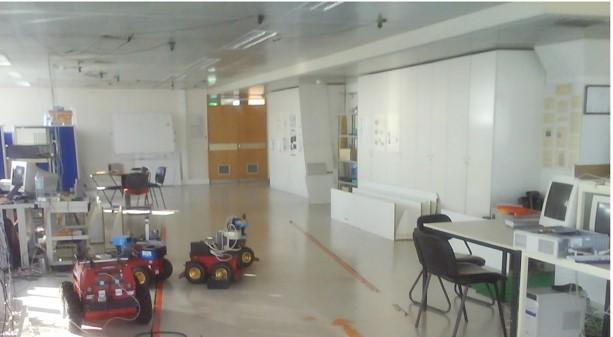
You are a GUI agent. You are given a task and a screenshot of the screen. Output one action in this format:
    pyautogui.click(x=<x>, y=<y>)
    Task: Click on the blue wall
    The image size is (613, 337).
    Given the screenshot: What is the action you would take?
    pyautogui.click(x=63, y=146)